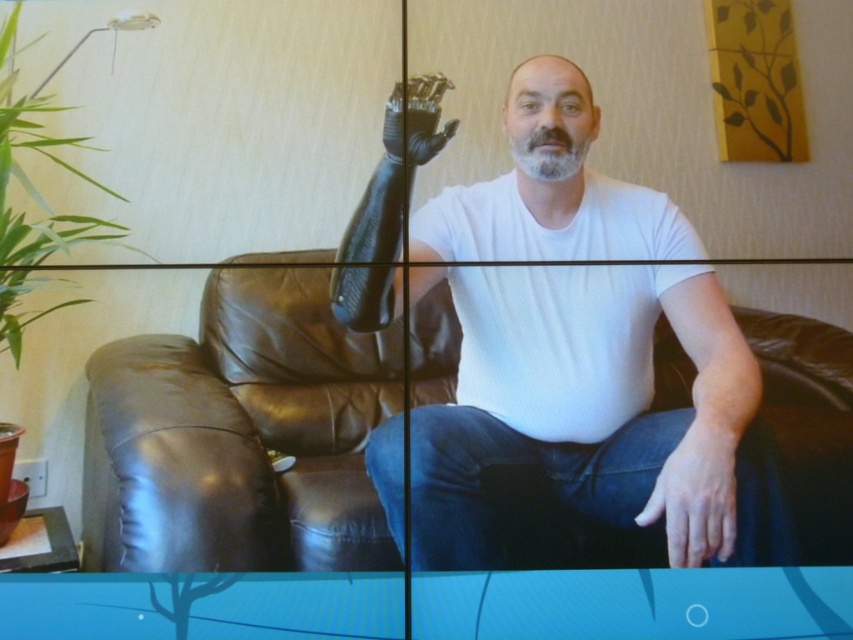
You are attending a virtual meeting and need to position your black matte prosthetic hand at upper center so it appears in the center of the video frame. Currently, it is positioned to the right of the brown leather couch at center. Can you move the prosthetic hand to the left to center it?

The brown leather couch at center is to the left of the black matte prosthetic hand at upper center, so moving the prosthetic hand to the left would bring it closer to the couch and potentially center it in the frame.

You are a medical student observing a patient during a telehealth consultation. The patient has a black matte prosthetic hand at upper center and a gray matte beard at center. Based on their position, which object is higher in the image?

The black matte prosthetic hand at upper center is located above the gray matte beard at center, so the black matte prosthetic hand at upper center is higher in the image.